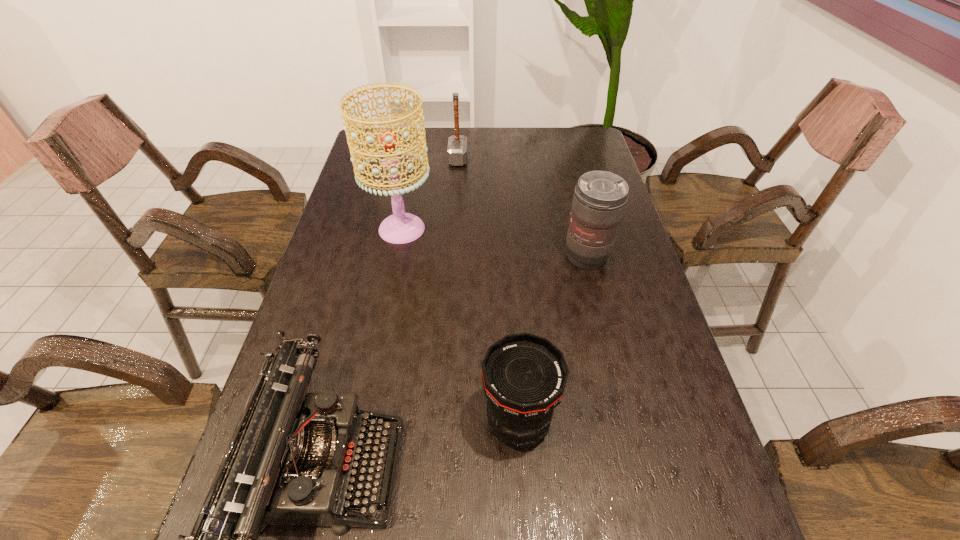
The width and height of the screenshot is (960, 540). Identify the location of vacant area situated 0.130m on the left of the second object from right to left. (417, 423).

You are a GUI agent. You are given a task and a screenshot of the screen. Output one action in this format:
    pyautogui.click(x=<x>, y=<y>)
    Task: Click on the object located at the far edge
    This screenshot has height=540, width=960.
    Given the screenshot: What is the action you would take?
    pyautogui.click(x=457, y=144)

Locate an element on the screen. object at the left edge is located at coordinates (400, 228).

At what (x,y) coordinates should I click in order to perform the action: click on object located in the right edge section of the desktop. Please return your answer as a coordinate pair (x, y). Looking at the image, I should click on (600, 197).

You are a GUI agent. You are given a task and a screenshot of the screen. Output one action in this format:
    pyautogui.click(x=<x>, y=<y>)
    Task: Click on the vacant area at the far edge of the desktop
    The width and height of the screenshot is (960, 540).
    Given the screenshot: What is the action you would take?
    444,154

In the image, there is a desktop. At what (x,y) coordinates should I click in order to perform the action: click on vacant space at the left edge. Please return your answer as a coordinate pair (x, y). Looking at the image, I should click on (352, 210).

In the image, there is a desktop. Where is `vacant space at the right edge`? vacant space at the right edge is located at coordinates (623, 235).

You are a GUI agent. You are given a task and a screenshot of the screen. Output one action in this format:
    pyautogui.click(x=<x>, y=<y>)
    Task: Click on the free space between the left telephoto lens and the farther telephoto lens
    The height and width of the screenshot is (540, 960).
    Given the screenshot: What is the action you would take?
    pyautogui.click(x=552, y=340)

Where is `vacant area that lies between the hammer and the right telephoto lens`? vacant area that lies between the hammer and the right telephoto lens is located at coordinates (522, 208).

The width and height of the screenshot is (960, 540). I want to click on free space between the second object from right to left and the lampshade, so click(x=460, y=326).